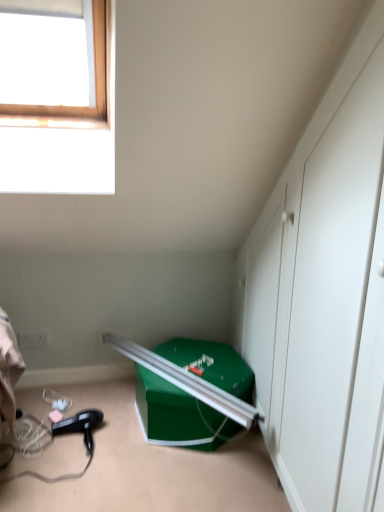
What do you see at coordinates (80, 426) in the screenshot?
I see `black plastic hair dryer at lower left` at bounding box center [80, 426].

Where is `black plastic hair dryer at lower left`? black plastic hair dryer at lower left is located at coordinates tap(80, 426).

This screenshot has width=384, height=512. Find the location of `green cardboard box at lower right`. green cardboard box at lower right is located at coordinates (178, 415).

What is the approximate width of green cardboard box at lower right?

green cardboard box at lower right is 23.47 inches in width.

The image size is (384, 512). Describe the element at coordinates (178, 415) in the screenshot. I see `green cardboard box at lower right` at that location.

At what (x,y) coordinates should I click in order to perform the action: click on black plastic hair dryer at lower left. Please return your answer as a coordinate pair (x, y). Looking at the image, I should click on (80, 426).

Visually, is green cardboard box at lower right positioned to the left or to the right of black plastic hair dryer at lower left?

green cardboard box at lower right is to the right of black plastic hair dryer at lower left.

Does green cardboard box at lower right come in front of black plastic hair dryer at lower left?

Yes, the depth of green cardboard box at lower right is less than that of black plastic hair dryer at lower left.

Considering the positions of point (223, 353) and point (77, 417), is point (223, 353) closer or farther from the camera than point (77, 417)?

Clearly, point (223, 353) is more distant from the camera than point (77, 417).

From the image's perspective, between green cardboard box at lower right and black plastic hair dryer at lower left, who is located below?

black plastic hair dryer at lower left appears lower in the image.

From a real-world perspective, relative to black plastic hair dryer at lower left, is green cardboard box at lower right vertically above or below?

green cardboard box at lower right is situated higher than black plastic hair dryer at lower left in the real world.

Can you confirm if green cardboard box at lower right is thinner than black plastic hair dryer at lower left?

Incorrect, the width of green cardboard box at lower right is not less than that of black plastic hair dryer at lower left.

Considering the sizes of objects green cardboard box at lower right and black plastic hair dryer at lower left in the image provided, who is shorter, green cardboard box at lower right or black plastic hair dryer at lower left?

black plastic hair dryer at lower left.

Who is bigger, green cardboard box at lower right or black plastic hair dryer at lower left?

green cardboard box at lower right is bigger.

Can we say green cardboard box at lower right lies outside black plastic hair dryer at lower left?

green cardboard box at lower right is positioned outside black plastic hair dryer at lower left.

Is green cardboard box at lower right directly adjacent to black plastic hair dryer at lower left?

green cardboard box at lower right and black plastic hair dryer at lower left are not in contact.

Is green cardboard box at lower right facing away from black plastic hair dryer at lower left?

No, green cardboard box at lower right's orientation is not away from black plastic hair dryer at lower left.

What's the angular difference between green cardboard box at lower right and black plastic hair dryer at lower left's facing directions?

The facing directions of green cardboard box at lower right and black plastic hair dryer at lower left are 13.4 degrees apart.

Where is `box lying on the right of black plastic hair dryer at lower left`? Image resolution: width=384 pixels, height=512 pixels. box lying on the right of black plastic hair dryer at lower left is located at coordinates (178, 415).

Based on the photo, considering the relative positions of black plastic hair dryer at lower left and green cardboard box at lower right in the image provided, is black plastic hair dryer at lower left to the right of green cardboard box at lower right from the viewer's perspective?

No, black plastic hair dryer at lower left is not to the right of green cardboard box at lower right.

Considering the positions of objects black plastic hair dryer at lower left and green cardboard box at lower right in the image provided, who is in front, black plastic hair dryer at lower left or green cardboard box at lower right?

green cardboard box at lower right is in front.

Considering the positions of point (87, 431) and point (202, 431), is point (87, 431) closer or farther from the camera than point (202, 431)?

Point (87, 431) appears to be farther away from the viewer than point (202, 431).

From the image's perspective, does black plastic hair dryer at lower left appear higher than green cardboard box at lower right?

Actually, black plastic hair dryer at lower left appears below green cardboard box at lower right in the image.

From a real-world perspective, is black plastic hair dryer at lower left positioned above or below green cardboard box at lower right?

black plastic hair dryer at lower left is below green cardboard box at lower right.

Which of these two, black plastic hair dryer at lower left or green cardboard box at lower right, is thinner?

Thinner between the two is black plastic hair dryer at lower left.

Who is taller, black plastic hair dryer at lower left or green cardboard box at lower right?

green cardboard box at lower right.

Based on the photo, which of these two, black plastic hair dryer at lower left or green cardboard box at lower right, is smaller?

black plastic hair dryer at lower left is smaller.

Which is correct: black plastic hair dryer at lower left is inside green cardboard box at lower right, or outside of it?

black plastic hair dryer at lower left lies outside green cardboard box at lower right.

Can you see black plastic hair dryer at lower left touching green cardboard box at lower right?

No, black plastic hair dryer at lower left is not next to green cardboard box at lower right.

Is black plastic hair dryer at lower left looking in the opposite direction of green cardboard box at lower right?

No.

Identify the location of hair drier that is below the green cardboard box at lower right (from the image's perspective). This screenshot has width=384, height=512. (80, 426).

You are a GUI agent. You are given a task and a screenshot of the screen. Output one action in this format:
    pyautogui.click(x=<x>, y=<y>)
    Task: Click on the hair drier lying on the left of green cardboard box at lower right
    The image size is (384, 512).
    Given the screenshot: What is the action you would take?
    pyautogui.click(x=80, y=426)

In order to click on box located above the black plastic hair dryer at lower left (from the image's perspective) in this screenshot , I will do `click(178, 415)`.